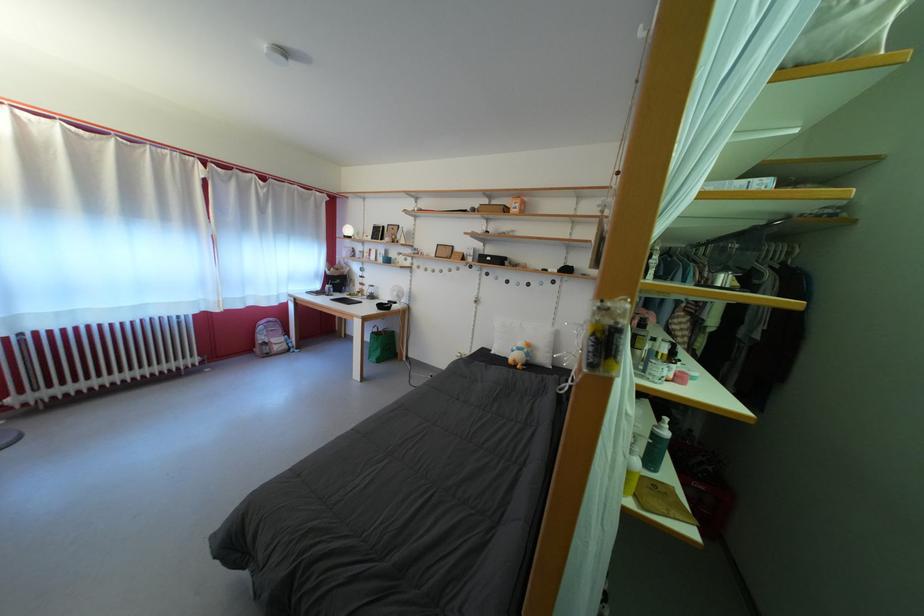
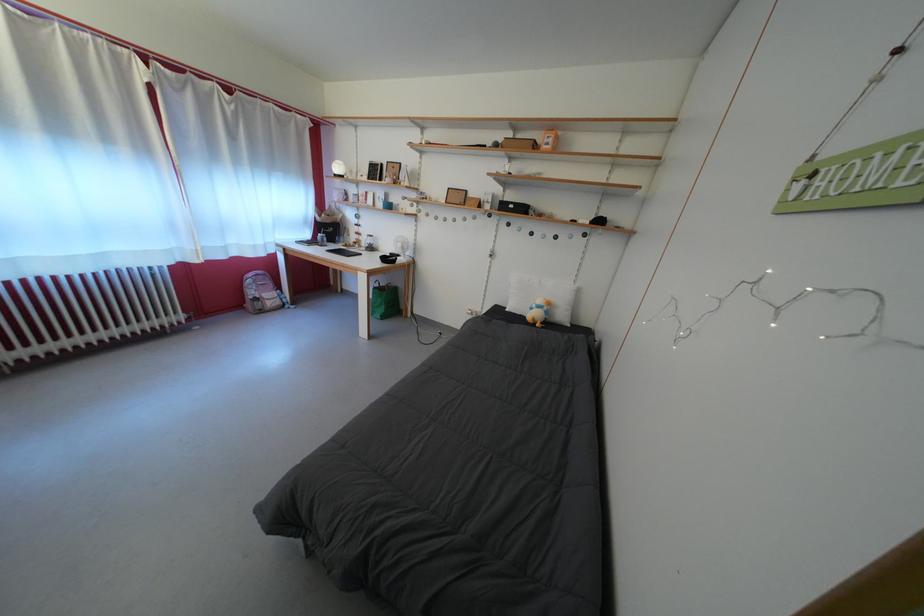
Locate, in the second image, the point that corresponds to (x=536, y=361) in the first image.

(554, 318)